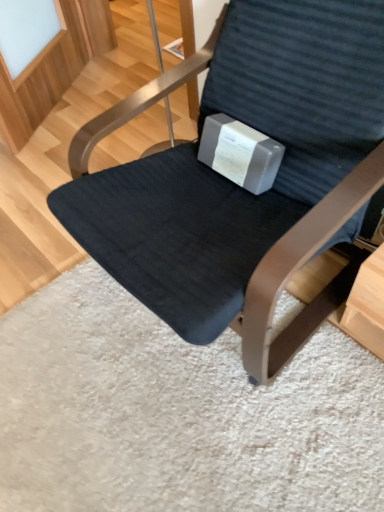
Measure the distance between point (232, 46) and camera.

They are 3.78 feet apart.

The height and width of the screenshot is (512, 384). Find the location of `black fabric chair at center`. black fabric chair at center is located at coordinates (239, 187).

What do you see at coordinates (239, 187) in the screenshot? I see `black fabric chair at center` at bounding box center [239, 187].

I want to click on black fabric chair at center, so click(x=239, y=187).